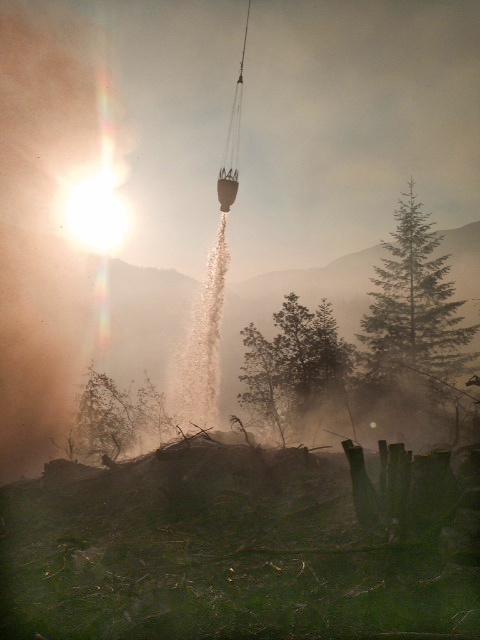
You are a hiker trying to navigate through the forest. You see a green textured pine tree at center right and a green matte tree at center. Which tree would you choose to use as a landmark for navigation, and why?

You should choose the green textured pine tree at center right as a landmark because it is bigger than the green matte tree at center, making it more visible and easier to identify from a distance.

You are a park ranger planning to plant a new tree that requires at least 10 meters of space between it and the nearest tree to ensure proper growth. You see the green textured pine tree at center right and the green matte tree at center. Can you plant the new tree between them?

The green textured pine tree at center right is 9.55 meters from the green matte tree at center, which is less than the required 10 meters. Therefore, you cannot plant the new tree between them as they are too close together.

You are an environmental scientist assessing the area. You need to determine which object occupies a wider area in the scene. Based on the image, which is wider between the green textured pine tree at center right and the translucent sand at center?

The green textured pine tree at center right is wider than the translucent sand at center according to the description.